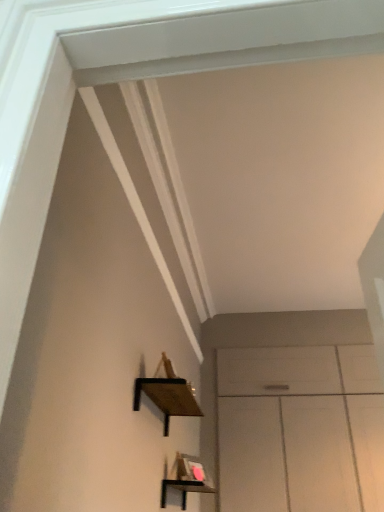
Question: Considering the positions of point (158, 403) and point (162, 480), is point (158, 403) closer or farther from the camera than point (162, 480)?

Choices:
 (A) closer
 (B) farther

Answer: (A)

Question: In terms of width, does wooden at left, which is the 2th shelf from bottom to top, look wider or thinner when compared to black wood shelf at lower center, positioned as the 2th shelf in top-to-bottom order?

Choices:
 (A) thin
 (B) wide

Answer: (A)

Question: From the image's perspective, is wooden at left, which ranks as the first shelf in top-to-bottom order, above or below black wood shelf at lower center, placed as the first shelf when sorted from bottom to top?

Choices:
 (A) below
 (B) above

Answer: (B)

Question: From the image's perspective, is black wood shelf at lower center, positioned as the 2th shelf in top-to-bottom order, positioned above or below wooden at left, which ranks as the first shelf in top-to-bottom order?

Choices:
 (A) below
 (B) above

Answer: (A)

Question: Is black wood shelf at lower center, positioned as the 2th shelf in top-to-bottom order, wider or thinner than wooden at left, which ranks as the first shelf in top-to-bottom order?

Choices:
 (A) thin
 (B) wide

Answer: (B)

Question: Looking at the image, does black wood shelf at lower center, positioned as the 2th shelf in top-to-bottom order, seem bigger or smaller compared to wooden at left, which ranks as the first shelf in top-to-bottom order?

Choices:
 (A) small
 (B) big

Answer: (B)

Question: From a real-world perspective, is black wood shelf at lower center, positioned as the 2th shelf in top-to-bottom order, physically located above or below wooden at left, which is the 2th shelf from bottom to top?

Choices:
 (A) below
 (B) above

Answer: (A)